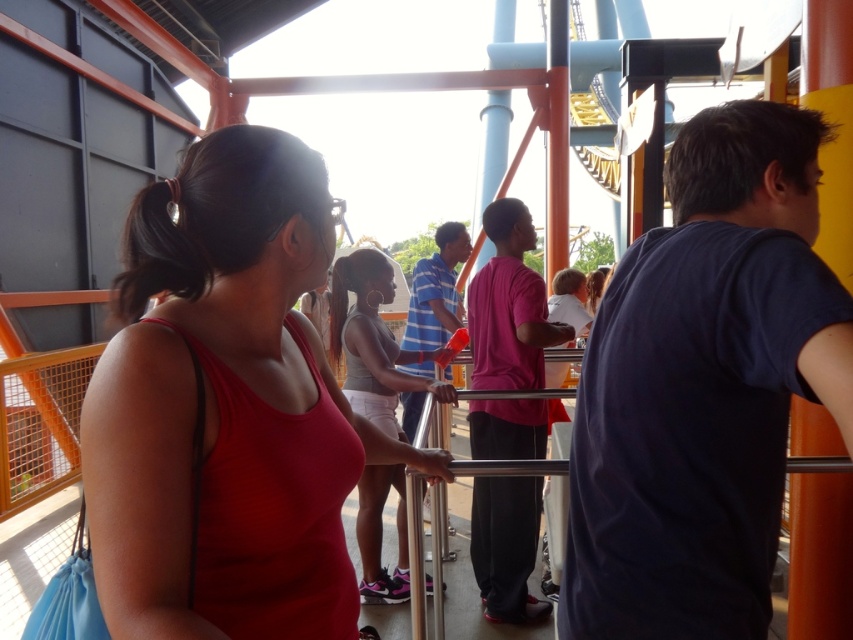
Question: Which point is closer to the camera?

Choices:
 (A) (288, 252)
 (B) (374, 497)

Answer: (A)

Question: Considering the relative positions of matte red tank top at center and gray fabric tank top at center in the image provided, where is matte red tank top at center located with respect to gray fabric tank top at center?

Choices:
 (A) left
 (B) right

Answer: (B)

Question: Does matte red tank top at center appear on the left side of gray fabric tank top at center?

Choices:
 (A) no
 (B) yes

Answer: (A)

Question: Can you confirm if matte red tank top at center is positioned to the left of gray fabric tank top at center?

Choices:
 (A) yes
 (B) no

Answer: (B)